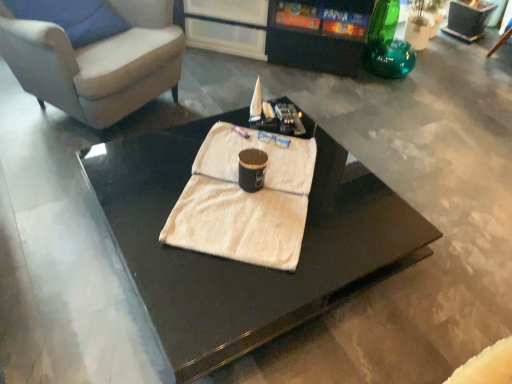
I want to click on free location in front of white textured towel at center, so click(219, 296).